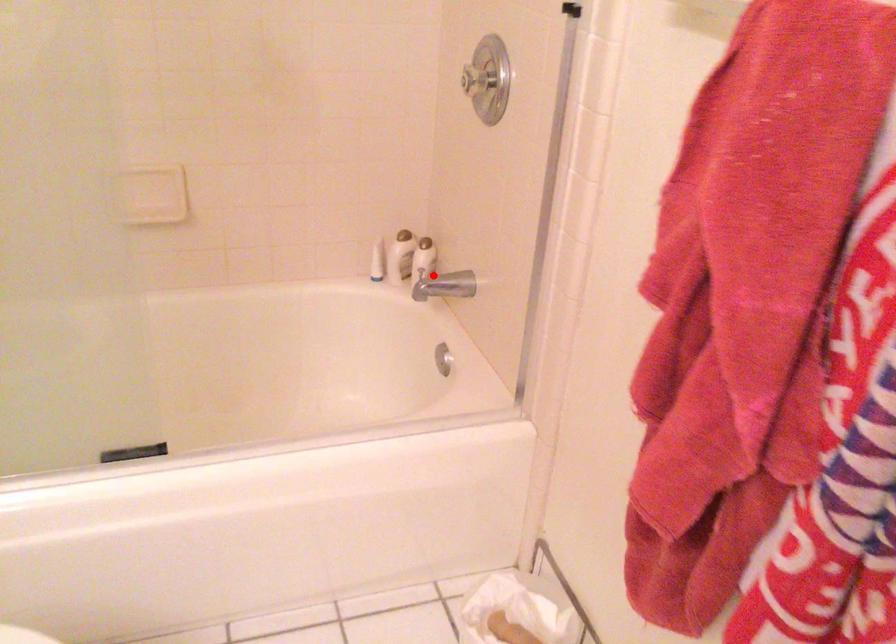
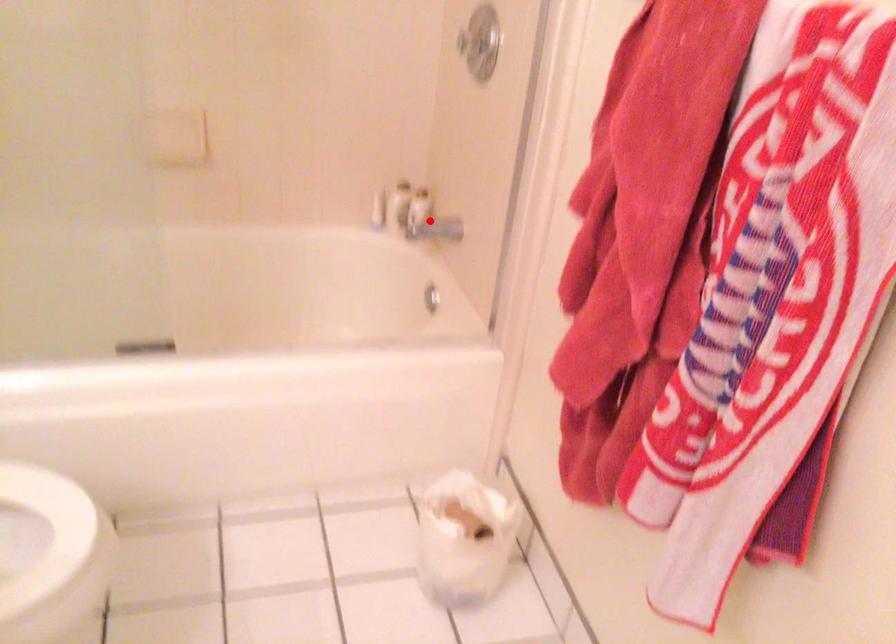
I am providing you with two images of the same scene from different viewpoints. A red point is marked on the first image and another point is marked on the second image. Does the point marked in image1 correspond to the same location as the one in image2?

Yes